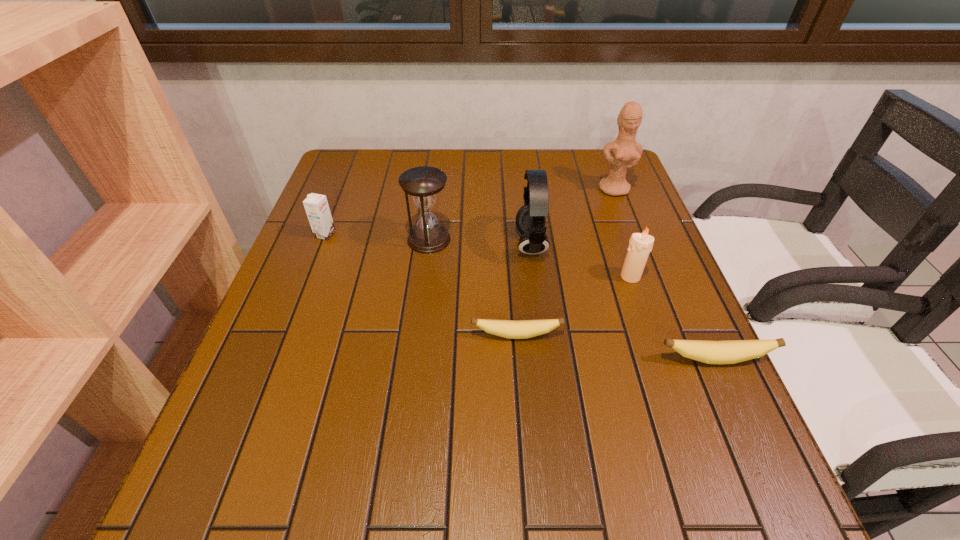
Please point a free position for a banana on the left. Please provide its 2D coordinates. Your answer should be formatted as a tuple, i.e. [(x, y)], where the tuple contains the x and y coordinates of a point satisfying the conditions above.

[(336, 314)]